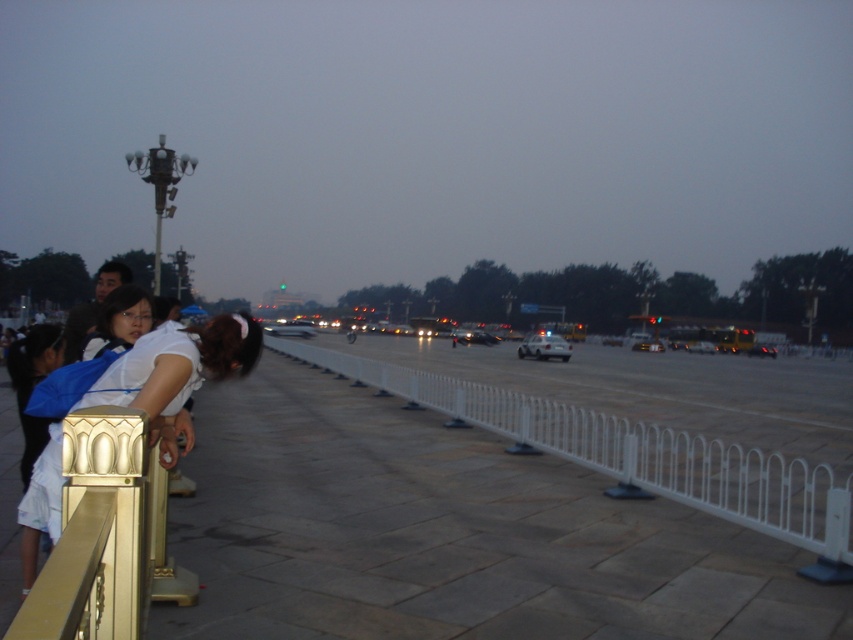
Describe the element at coordinates (177, 372) in the screenshot. The height and width of the screenshot is (640, 853). I see `gold metallic railing at left` at that location.

Looking at this image, who is lower down, gold metallic railing at left or white glossy car at center?

white glossy car at center is lower down.

Between point (149, 376) and point (526, 353), which one is positioned behind?

The point (526, 353) is behind.

Locate an element on the screen. The width and height of the screenshot is (853, 640). gold metallic railing at left is located at coordinates coord(177,372).

Is white metal fence at center shorter than white glossy car at center?

Yes.

Between point (717, 461) and point (547, 333), which one is positioned behind?

Positioned behind is point (547, 333).

The image size is (853, 640). Describe the element at coordinates (635, 456) in the screenshot. I see `white metal fence at center` at that location.

Locate an element on the screen. white metal fence at center is located at coordinates (635, 456).

Who is higher up, white metal fence at center or gold metallic railing at left?

Positioned higher is gold metallic railing at left.

Between white metal fence at center and gold metallic railing at left, which one is positioned lower?

white metal fence at center is lower down.

Describe the element at coordinates (635, 456) in the screenshot. I see `white metal fence at center` at that location.

Image resolution: width=853 pixels, height=640 pixels. I want to click on white metal fence at center, so click(x=635, y=456).